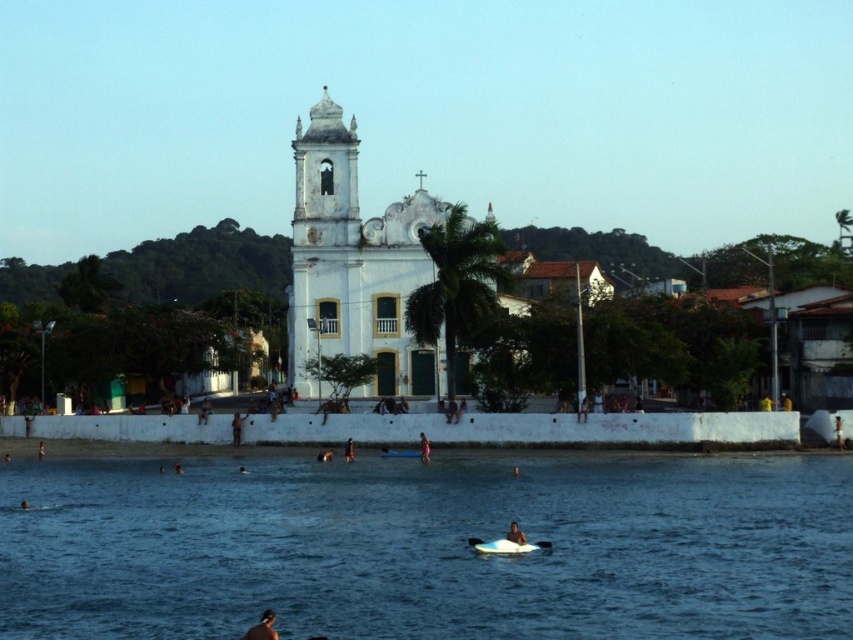
Question: Which of these objects is positioned farthest from the dark blue fabric surfboard at center?

Choices:
 (A) pink fabric surfboard at center
 (B) smooth white surfboard at center

Answer: (B)

Question: Is blue water at center wider than smooth skin person at center?

Choices:
 (A) yes
 (B) no

Answer: (A)

Question: Which of these objects is positioned closest to the white foam surfboard at lower center?

Choices:
 (A) smooth skin person at lower left
 (B) white matte church at center
 (C) brown leather surfboard at lower center
 (D) pink fabric surfboard at center

Answer: (D)

Question: Can you confirm if smooth skin person at lower center is bigger than brown leather surfboard at lower center?

Choices:
 (A) yes
 (B) no

Answer: (B)

Question: Which object appears farthest from the camera in this image?

Choices:
 (A) smooth white surfboard at center
 (B) smooth skin person at lower left
 (C) smooth skin person at center
 (D) blue water at center

Answer: (B)

Question: Can you confirm if blue water at center is bigger than pink fabric surfboard at center?

Choices:
 (A) no
 (B) yes

Answer: (B)